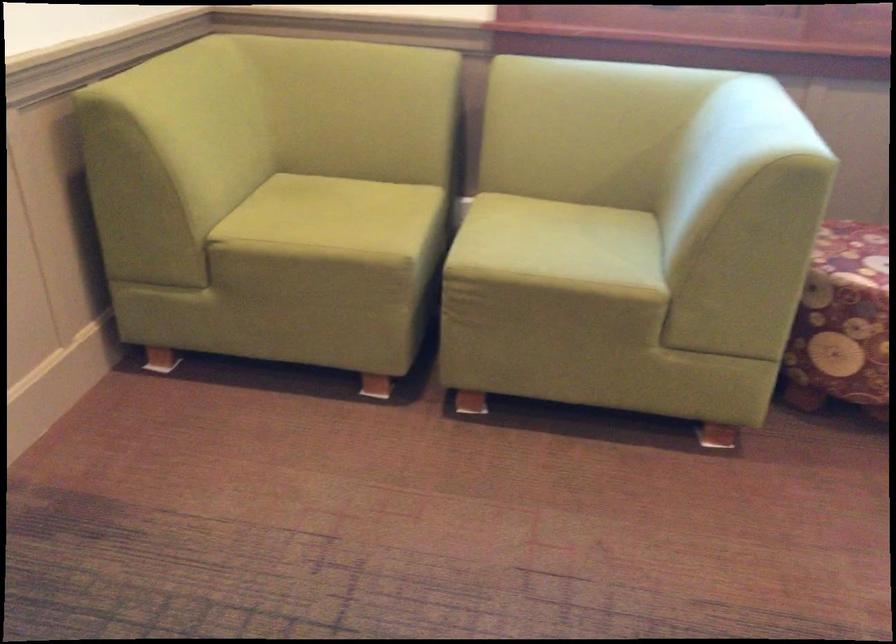
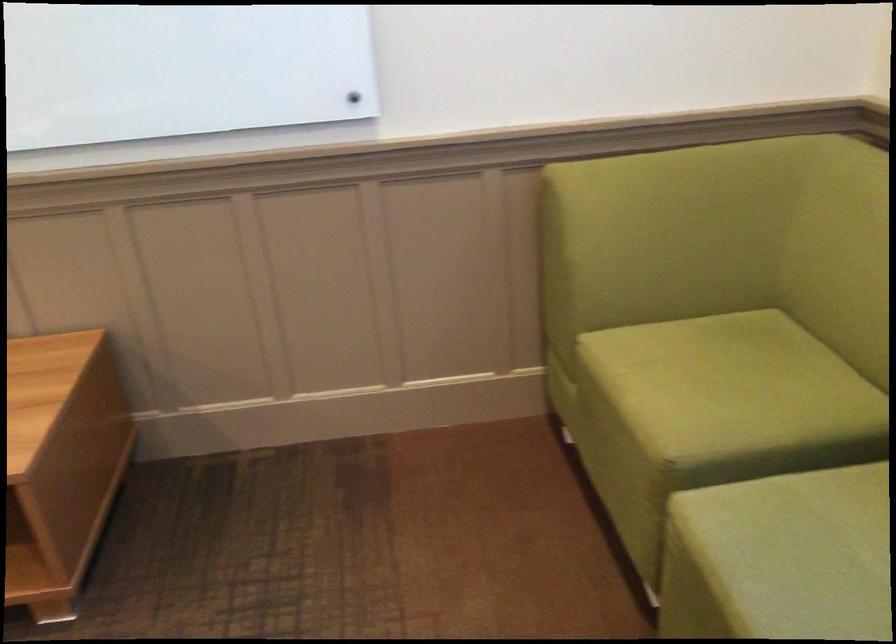
Locate, in the second image, the point that corresponds to point 357,214 in the first image.

(727, 384)